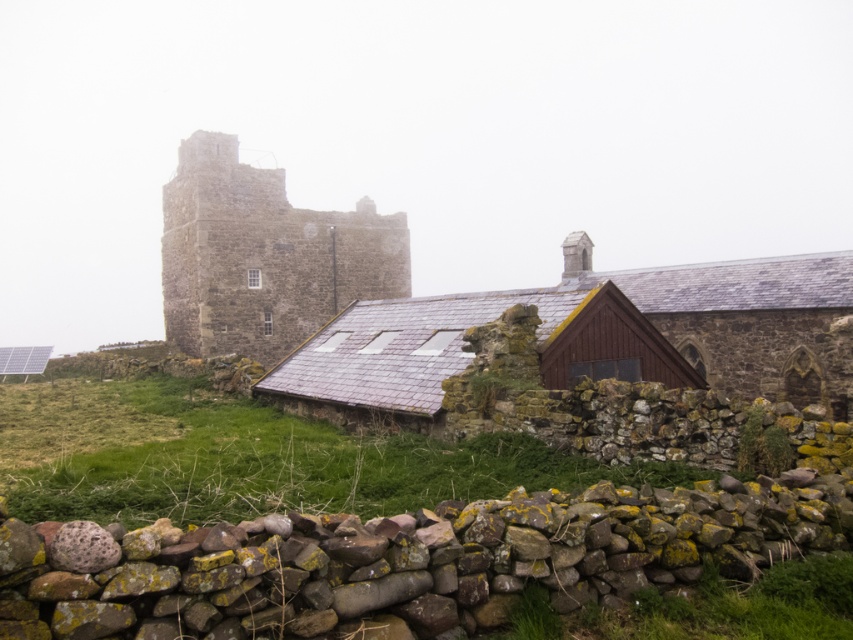
Question: Which object appears closest to the camera in this image?

Choices:
 (A) stone tower at upper left
 (B) green mossy grass at lower center
 (C) stone tower at center
 (D) green grass at lower left

Answer: (B)

Question: Which of the following is the farthest from the observer?

Choices:
 (A) green mossy grass at lower center
 (B) green grass at lower left
 (C) stone tower at center
 (D) stone tower at upper left

Answer: (D)

Question: Is green grass at lower left further to camera compared to stone tower at upper left?

Choices:
 (A) no
 (B) yes

Answer: (A)

Question: Which point is closer to the camera?

Choices:
 (A) (312, 257)
 (B) (798, 595)
 (C) (171, 458)
 (D) (358, 209)

Answer: (B)

Question: Is green grass at lower left below green mossy grass at lower center?

Choices:
 (A) yes
 (B) no

Answer: (B)

Question: Is stone tower at center closer to the viewer compared to stone tower at upper left?

Choices:
 (A) yes
 (B) no

Answer: (A)